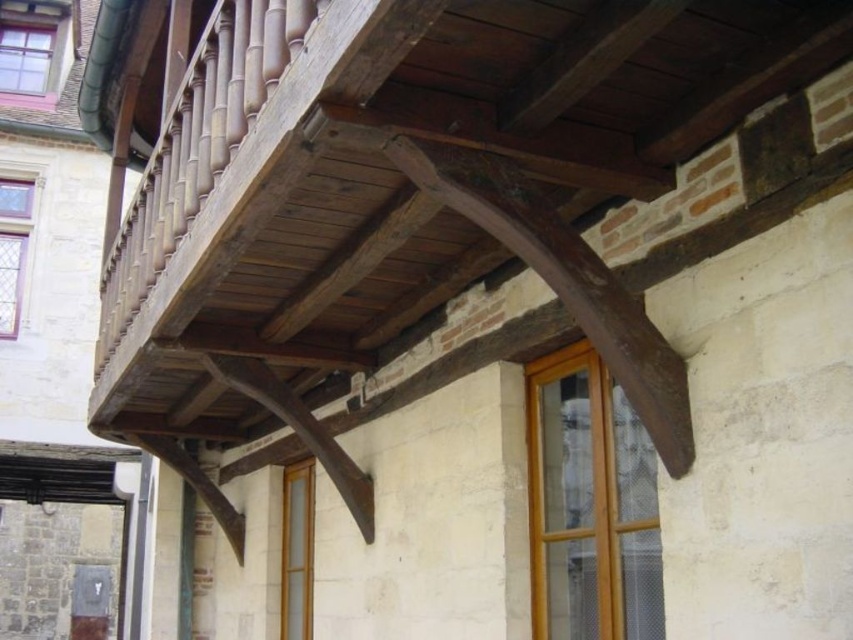
Which is more to the left, clear glass door at center or clear glass window at upper left?

clear glass window at upper left

Is clear glass door at center positioned behind clear glass window at upper left?

No.

In order to click on clear glass door at center in this screenshot , I will do `click(296, 550)`.

This screenshot has width=853, height=640. What are the coordinates of `clear glass door at center` in the screenshot? It's located at (296, 550).

Does clear glass window at center appear on the right side of clear glass door at center?

Yes, clear glass window at center is to the right of clear glass door at center.

Locate an element on the screen. clear glass window at center is located at coordinates (590, 504).

Find the location of a particular element. Image resolution: width=853 pixels, height=640 pixels. clear glass window at center is located at coordinates (590, 504).

Is weathered wood balcony at upper center below clear glass window at upper left?

Correct, weathered wood balcony at upper center is located below clear glass window at upper left.

Does weathered wood balcony at upper center have a lesser height compared to clear glass window at upper left?

Indeed, weathered wood balcony at upper center has a lesser height compared to clear glass window at upper left.

Which is in front, point (407, 337) or point (10, 244)?

Point (407, 337) is in front.

Identify the location of weathered wood balcony at upper center. (409, 179).